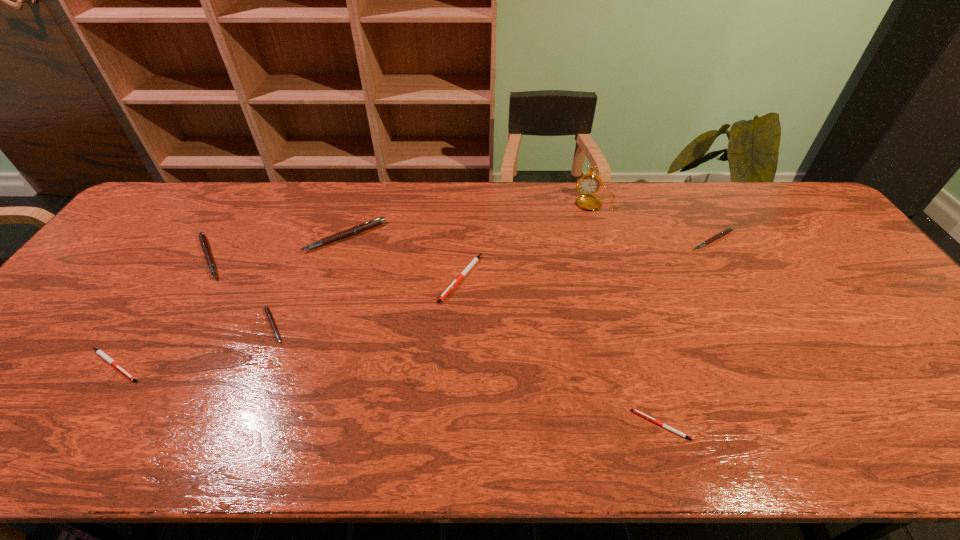
Where is `white pen that stands as the third closest to the rightmost pink pen`? The height and width of the screenshot is (540, 960). white pen that stands as the third closest to the rightmost pink pen is located at coordinates (99, 352).

The width and height of the screenshot is (960, 540). What are the coordinates of `white pen that is the closest one to the second biggest white pen` in the screenshot? It's located at (473, 262).

Where is `blank area in the image that satisfies the following two spatial constraints: 1. on the face of the tallest object; 2. at the nib of the smallest pink pen`? The width and height of the screenshot is (960, 540). blank area in the image that satisfies the following two spatial constraints: 1. on the face of the tallest object; 2. at the nib of the smallest pink pen is located at coordinates (634, 325).

The height and width of the screenshot is (540, 960). I want to click on vacant position in the image that satisfies the following two spatial constraints: 1. on the clicker of the farthest white pen; 2. on the clicker of the second biggest white pen, so click(x=457, y=365).

Identify the location of vacant space that satisfies the following two spatial constraints: 1. at the nib of the biggest pink pen; 2. on the clicker of the seventh farthest object. (303, 365).